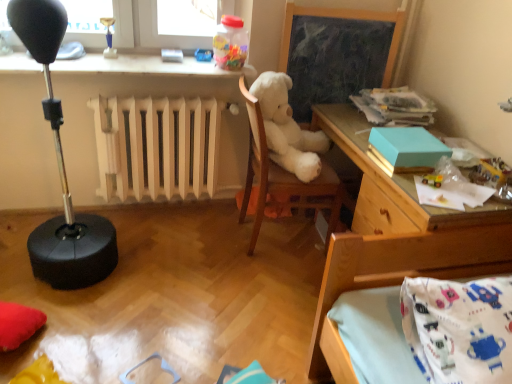
Question: Should I look upward or downward to see white plush at center?

Choices:
 (A) down
 (B) up

Answer: (B)

Question: Can you confirm if teal matte box at upper right is taller than metallic silver toy at upper right, which ranks as the 2th toy in bottom-to-top order?

Choices:
 (A) yes
 (B) no

Answer: (A)

Question: From a real-world perspective, does teal matte box at upper right stand above metallic silver toy at upper right, which is the second toy from front to back?

Choices:
 (A) no
 (B) yes

Answer: (B)

Question: Can you confirm if teal matte box at upper right is thinner than metallic silver toy at upper right, which is the first toy in right-to-left order?

Choices:
 (A) yes
 (B) no

Answer: (B)

Question: Is teal matte box at upper right wider than metallic silver toy at upper right, which appears as the fourth toy when viewed from the left?

Choices:
 (A) no
 (B) yes

Answer: (B)

Question: Is teal matte box at upper right bigger than metallic silver toy at upper right, the 3th toy from the back?

Choices:
 (A) yes
 (B) no

Answer: (A)

Question: Is teal matte box at upper right oriented away from metallic silver toy at upper right, marked as the 3th toy in a top-to-bottom arrangement?

Choices:
 (A) yes
 (B) no

Answer: (A)

Question: Considering the relative sizes of white plush at center and wooden chalkboard at center in the image provided, is white plush at center bigger than wooden chalkboard at center?

Choices:
 (A) no
 (B) yes

Answer: (B)

Question: From the image's perspective, is white plush at center below wooden chalkboard at center?

Choices:
 (A) yes
 (B) no

Answer: (A)

Question: Is white plush at center closer to the viewer compared to wooden chalkboard at center?

Choices:
 (A) no
 (B) yes

Answer: (B)

Question: Does white plush at center have a lesser width compared to wooden chalkboard at center?

Choices:
 (A) no
 (B) yes

Answer: (A)

Question: Is the surface of white plush at center in direct contact with wooden chalkboard at center?

Choices:
 (A) no
 (B) yes

Answer: (A)

Question: Is there a large distance between white plush at center and wooden chalkboard at center?

Choices:
 (A) no
 (B) yes

Answer: (A)

Question: Does metallic yellow toy car at upper right, the first toy when ordered from bottom to top, have a larger size compared to wooden chalkboard at center?

Choices:
 (A) yes
 (B) no

Answer: (B)